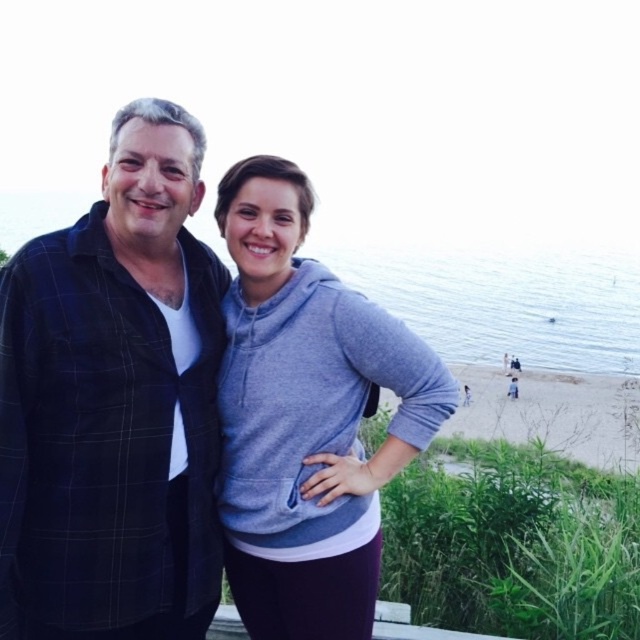
You are a photographer trying to capture a group shot of the dark blue plaid shirt at left and the gray fleece hoodie at center. To ensure both subjects are in frame, should you adjust your camera to a wider angle or a narrower angle?

Since the dark blue plaid shirt at left is to the left of the gray fleece hoodie at center, you should adjust your camera to a wider angle to ensure both subjects are in frame.

You are standing at point point (80, 480) and want to take a photo of the two people in the scene. The camera you have can focus on subjects within 5 meters. Will the camera be able to focus on the two people?

The point (80, 480) and camera are 4.44 meters apart from each other, so yes, the camera can focus on the two people since the distance is within the 5 meters range.

In the scene shown: You are a photographer trying to capture the dark blue plaid shirt at left in a closeup shot. What coordinates should you aim for to center the shirt in your viewfinder?

The dark blue plaid shirt at left is located at coordinates point (113, 403), so you should aim for those coordinates to center it in your viewfinder.